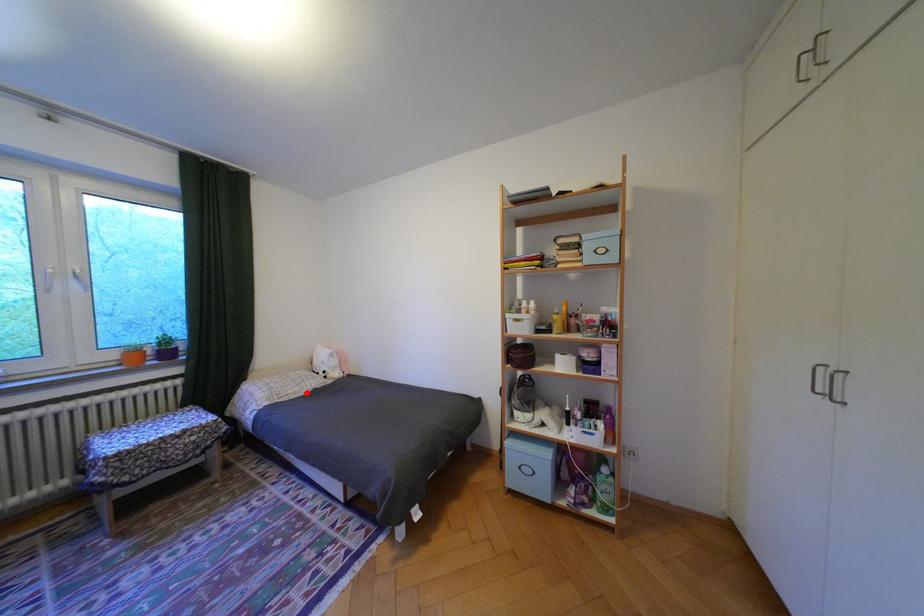
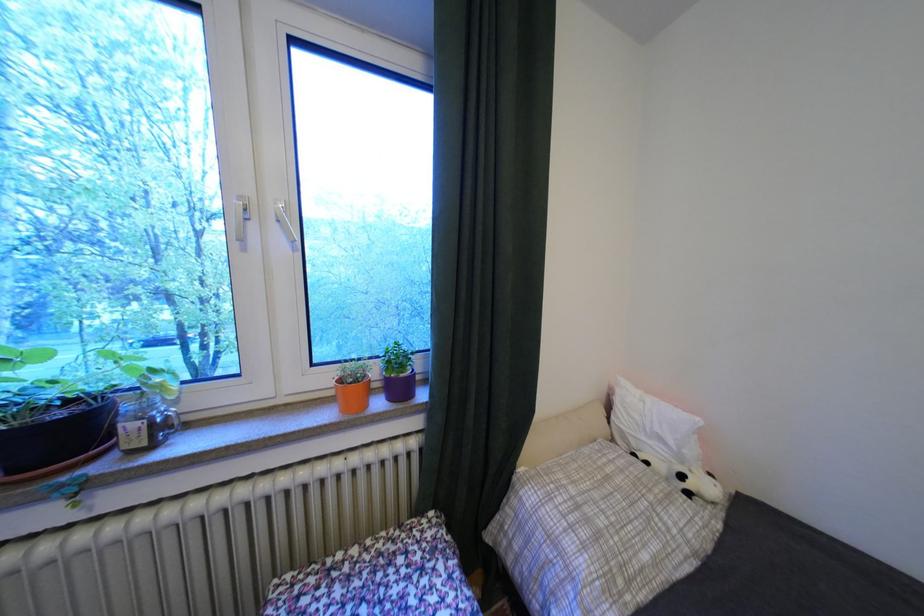
Where in the second image is the point corresponding to the highlighted location from the first image?

(667, 562)